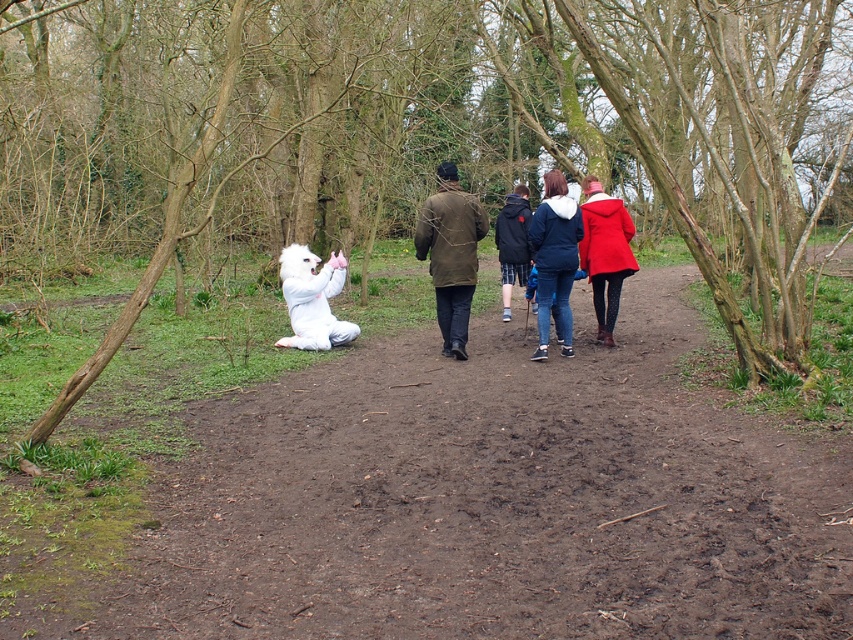
You are a photographer trying to capture the denim jacket at center in your shot. There is a brown bark tree at lower left blocking your view. Can you move the tree to get a clear shot of the jacket?

The brown bark tree at lower left is in front of the denim jacket at center, so you cannot move the tree. You will need to adjust your position or angle to capture the denim jacket at center without the tree obstructing the view.

You are standing in a wooded area and want to take a photo of both the mythical creature in the white costume and a distant landmark. The mythical creature is at point (244, 38) and the landmark is at point (554, 237). Based on their positions, which point is closer to you and should be in focus first?

Point (244, 38) is closer to you than point (554, 237), so you should focus on the mythical creature at point (244, 38) first to ensure it is in clear view before adjusting for the distant landmark at point (554, 237).

You are a photographer trying to capture the mythical creature in the woods. You notice a dark brown leather jacket at center. Where exactly is the dark brown leather jacket located in the scene?

The dark brown leather jacket at center is located at point 0.397 in the x coordinate and 0.530 in the y coordinate.